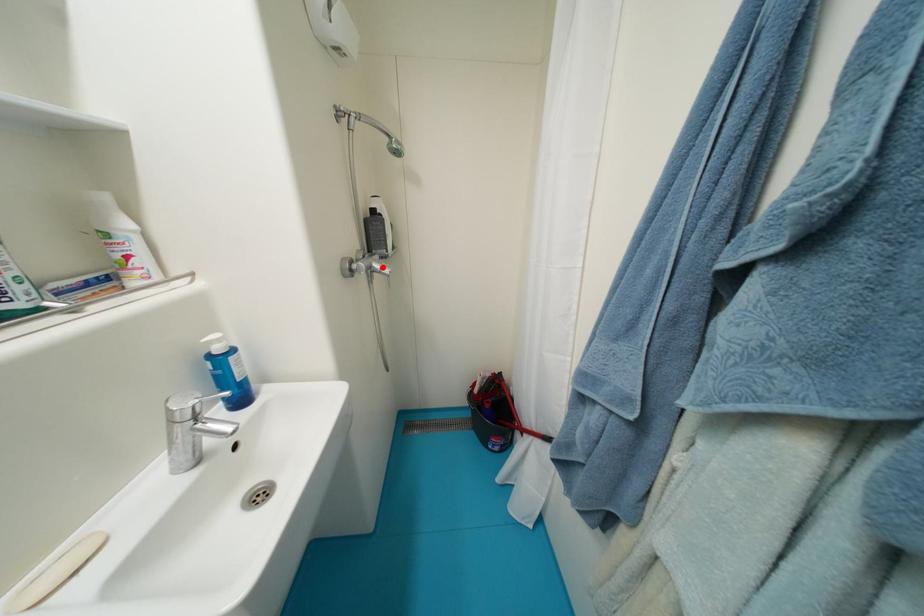
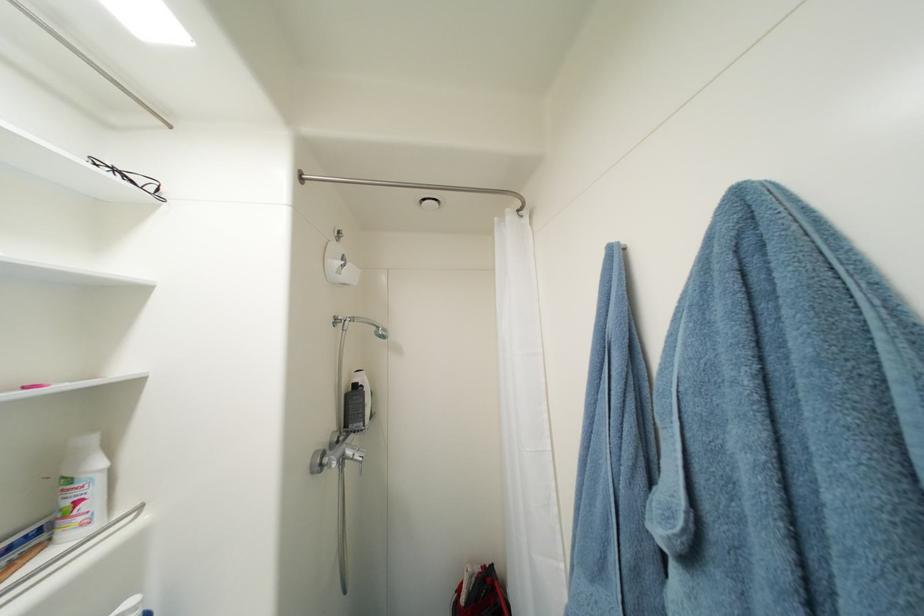
In the second image, find the point that corresponds to the highlighted location in the first image.

(356, 454)